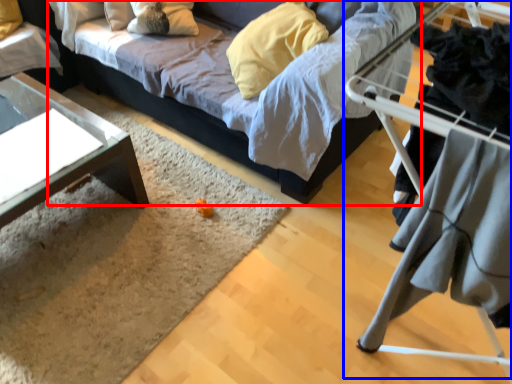
Question: Which point is closer to the camera, studio couch (highlighted by a red box) or bunk bed (highlighted by a blue box)?

Choices:
 (A) studio couch
 (B) bunk bed

Answer: (B)